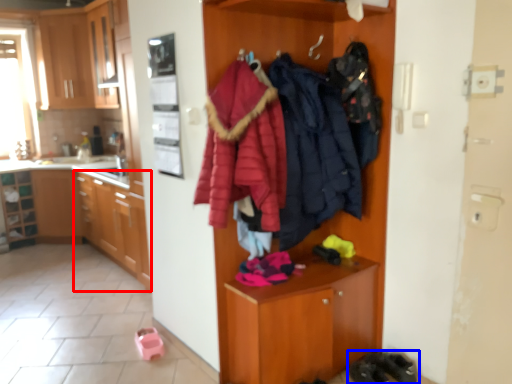
Question: Which point is closer to the camera, cabinetry (highlighted by a red box) or footwear (highlighted by a blue box)?

Choices:
 (A) cabinetry
 (B) footwear

Answer: (B)